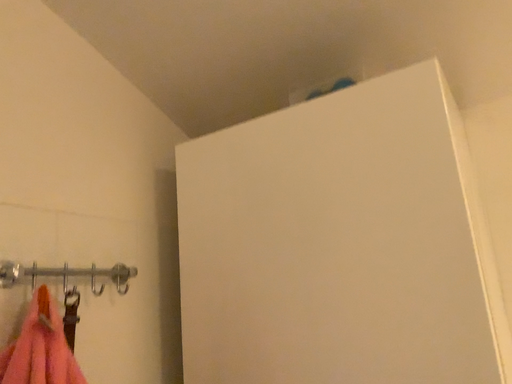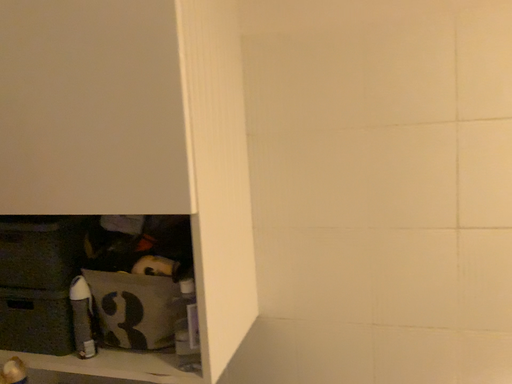
Question: How did the camera likely rotate when shooting the video?

Choices:
 (A) rotated left
 (B) rotated right

Answer: (B)